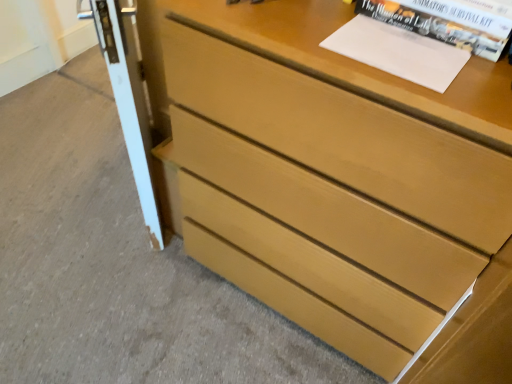
Image resolution: width=512 pixels, height=384 pixels. Describe the element at coordinates (341, 183) in the screenshot. I see `light brown wood chest of drawers at center` at that location.

You are a GUI agent. You are given a task and a screenshot of the screen. Output one action in this format:
    pyautogui.click(x=<x>, y=<y>)
    Task: Click on the white glossy screen door at left
    This screenshot has width=512, height=384.
    Given the screenshot: What is the action you would take?
    [x=128, y=96]

Is light brown wood chest of drawers at center taller or shorter than white paper at upper right?

In the image, light brown wood chest of drawers at center appears to be taller than white paper at upper right.

Considering the relative sizes of light brown wood chest of drawers at center and white paper at upper right in the image provided, is light brown wood chest of drawers at center smaller than white paper at upper right?

Actually, light brown wood chest of drawers at center might be larger than white paper at upper right.

Is light brown wood chest of drawers at center positioned with its back to white paper at upper right?

That's not correct — light brown wood chest of drawers at center is not looking away from white paper at upper right.

Considering the points (391, 84) and (437, 89), which point is in front, point (391, 84) or point (437, 89)?

The point (437, 89) is in front.

From a real-world perspective, relative to white glossy screen door at left, is white paper at upper right vertically above or below?

white paper at upper right is situated higher than white glossy screen door at left in the real world.

Considering the positions of point (450, 78) and point (116, 58), is point (450, 78) closer or farther from the camera than point (116, 58)?

Point (450, 78) is positioned closer to the camera compared to point (116, 58).

Is white paper at upper right taller than white glossy screen door at left?

No, white paper at upper right is not taller than white glossy screen door at left.

Is point (119, 92) farther from viewer compared to point (236, 70)?

Yes.

Based on the photo, is white glossy screen door at left oriented towards light brown wood chest of drawers at center?

No, white glossy screen door at left is not aimed at light brown wood chest of drawers at center.

Can you tell me how much white glossy screen door at left and light brown wood chest of drawers at center differ in facing direction?

The facing directions of white glossy screen door at left and light brown wood chest of drawers at center are 44.3 degrees apart.

In terms of size, does white glossy screen door at left appear bigger or smaller than light brown wood chest of drawers at center?

white glossy screen door at left is smaller than light brown wood chest of drawers at center.

From a real-world perspective, is white paper at upper right located higher than light brown wood chest of drawers at center?

Indeed, from a real-world perspective, white paper at upper right stands above light brown wood chest of drawers at center.

Which of these two, white paper at upper right or light brown wood chest of drawers at center, is wider?

Wider between the two is light brown wood chest of drawers at center.

From the image's perspective, between white paper at upper right and light brown wood chest of drawers at center, which one is located above?

white paper at upper right.

Is light brown wood chest of drawers at center facing towards white glossy screen door at left?

No, light brown wood chest of drawers at center is not facing towards white glossy screen door at left.

Which is behind, point (373, 327) or point (126, 127)?

The point (126, 127) is more distant.

Can you confirm if light brown wood chest of drawers at center is shorter than white glossy screen door at left?

In fact, light brown wood chest of drawers at center may be taller than white glossy screen door at left.

From the picture: From a real-world perspective, who is located lower, light brown wood chest of drawers at center or white glossy screen door at left?

white glossy screen door at left.

Find the location of a particular element. The image size is (512, 384). screen door that is on the left side of white paper at upper right is located at coordinates (128, 96).

Can you confirm if white glossy screen door at left is positioned to the right of white paper at upper right?

In fact, white glossy screen door at left is to the left of white paper at upper right.

From a real-world perspective, is white glossy screen door at left on white paper at upper right?

No.

Can white paper at upper right be found inside white glossy screen door at left?

No, white paper at upper right is not surrounded by white glossy screen door at left.

The height and width of the screenshot is (384, 512). I want to click on the chest of drawers located below the white paper at upper right (from the image's perspective), so click(x=341, y=183).

I want to click on paperback book on the right of white glossy screen door at left, so click(x=398, y=52).

Considering their positions, is light brown wood chest of drawers at center positioned closer to white paper at upper right than white glossy screen door at left?

light brown wood chest of drawers at center is closer to white paper at upper right.

Considering their positions, is light brown wood chest of drawers at center positioned closer to white glossy screen door at left than white paper at upper right?

light brown wood chest of drawers at center is closer to white glossy screen door at left.

From the image, which object appears to be farther from light brown wood chest of drawers at center, white glossy screen door at left or white paper at upper right?

white glossy screen door at left is positioned further to the anchor light brown wood chest of drawers at center.

Estimate the real-world distances between objects in this image. Which object is closer to white paper at upper right, white glossy screen door at left or light brown wood chest of drawers at center?

Based on the image, light brown wood chest of drawers at center appears to be nearer to white paper at upper right.

Which object lies further to the anchor point light brown wood chest of drawers at center, white paper at upper right or white glossy screen door at left?

Among the two, white glossy screen door at left is located further to light brown wood chest of drawers at center.

Based on their spatial positions, is white paper at upper right or light brown wood chest of drawers at center further from white glossy screen door at left?

A: white paper at upper right is positioned further to the anchor white glossy screen door at left.

This screenshot has width=512, height=384. In order to click on the chest of drawers located between white glossy screen door at left and white paper at upper right in the left-right direction in this screenshot , I will do `click(341, 183)`.